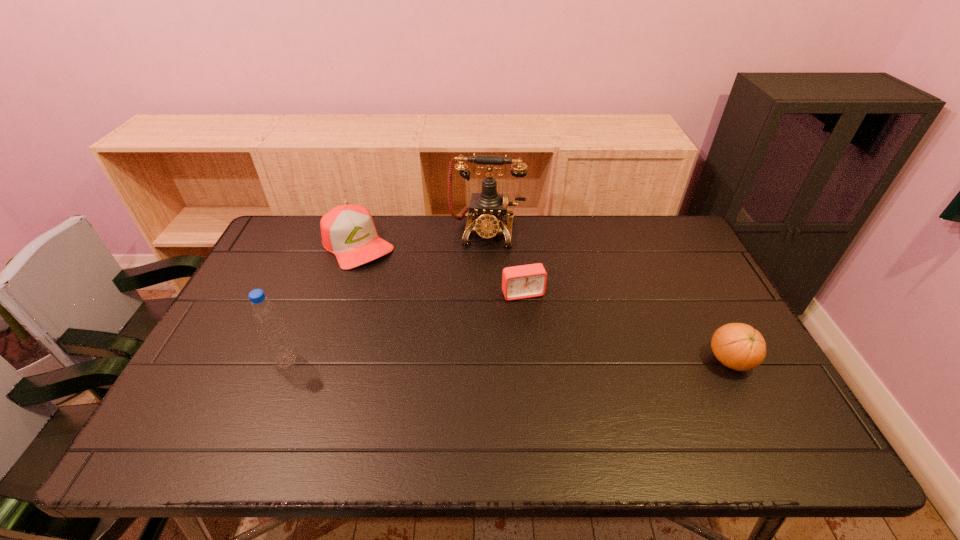
In the image, there is a desktop. Identify the location of free space at the far edge. (462, 227).

Find the location of a particular element. The image size is (960, 540). free region at the near edge is located at coordinates (709, 397).

You are a GUI agent. You are given a task and a screenshot of the screen. Output one action in this format:
    pyautogui.click(x=<x>, y=<y>)
    Task: Click on the free location at the left edge
    
    Given the screenshot: What is the action you would take?
    pyautogui.click(x=251, y=356)

In the image, there is a desktop. Where is `vacant space at the right edge`? The height and width of the screenshot is (540, 960). vacant space at the right edge is located at coordinates (691, 320).

Image resolution: width=960 pixels, height=540 pixels. I want to click on vacant space at the far left corner, so click(297, 234).

Identify the location of free point at the near left corner. (196, 411).

This screenshot has height=540, width=960. In order to click on free space at the near right corner of the desktop in this screenshot , I will do `click(713, 390)`.

This screenshot has height=540, width=960. What are the coordinates of `empty space between the shortest object and the rightmost object` in the screenshot? It's located at [626, 327].

You are a GUI agent. You are given a task and a screenshot of the screen. Output one action in this format:
    pyautogui.click(x=<x>, y=<y>)
    Task: Click on the vacant region between the third farthest object and the rightmost object
    
    Given the screenshot: What is the action you would take?
    pyautogui.click(x=626, y=327)

Find the location of a particular element. Image resolution: width=960 pixels, height=540 pixels. free space between the water bottle and the tallest object is located at coordinates (387, 296).